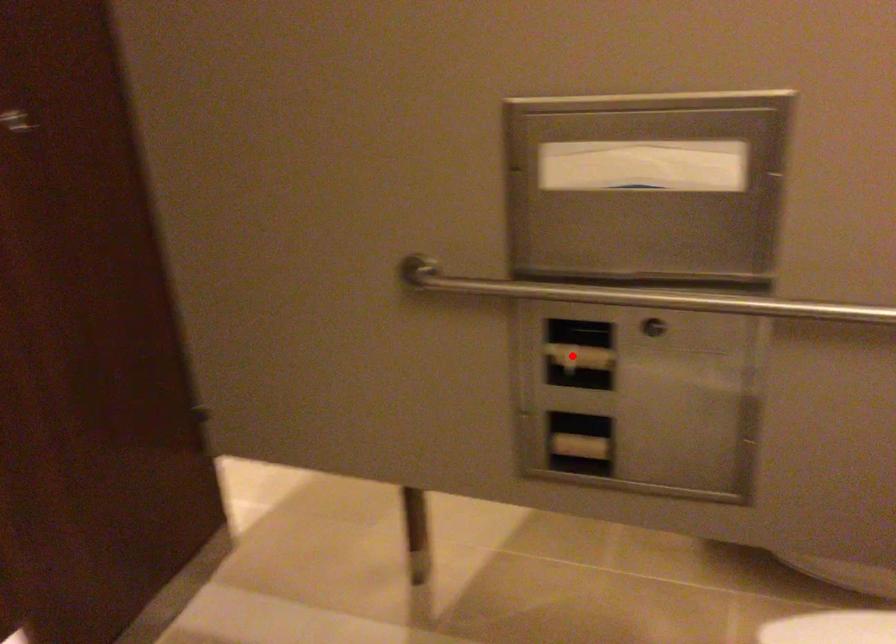
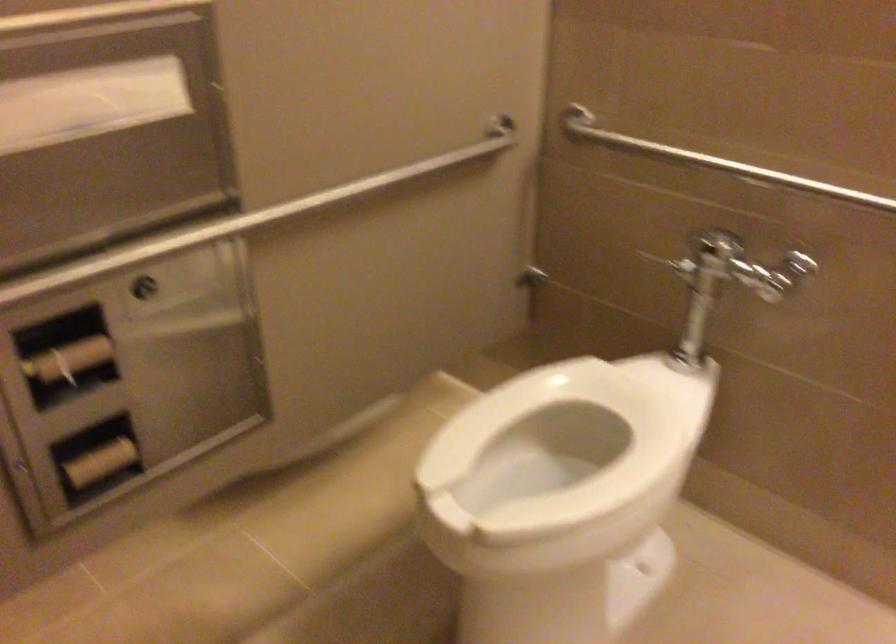
Locate, in the second image, the point that corresponds to the highlighted location in the first image.

(69, 359)